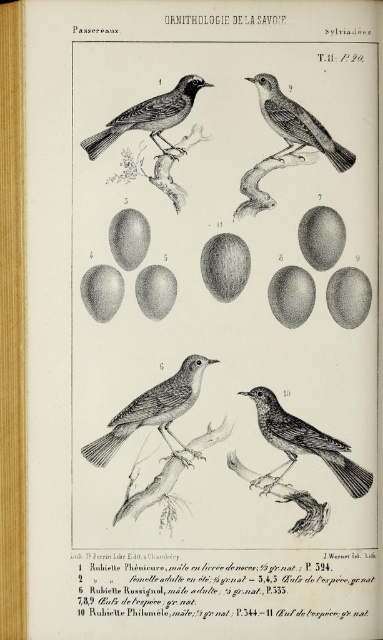
Based on the photo, looking at the illustration in the book, you notice two birds depicted on the page. One is a smooth black bird at center and the other is a black textured bird at upper left. Which bird is located lower on the page?

The smooth black bird at center is positioned under the black textured bird at upper left, so it is lower on the page.